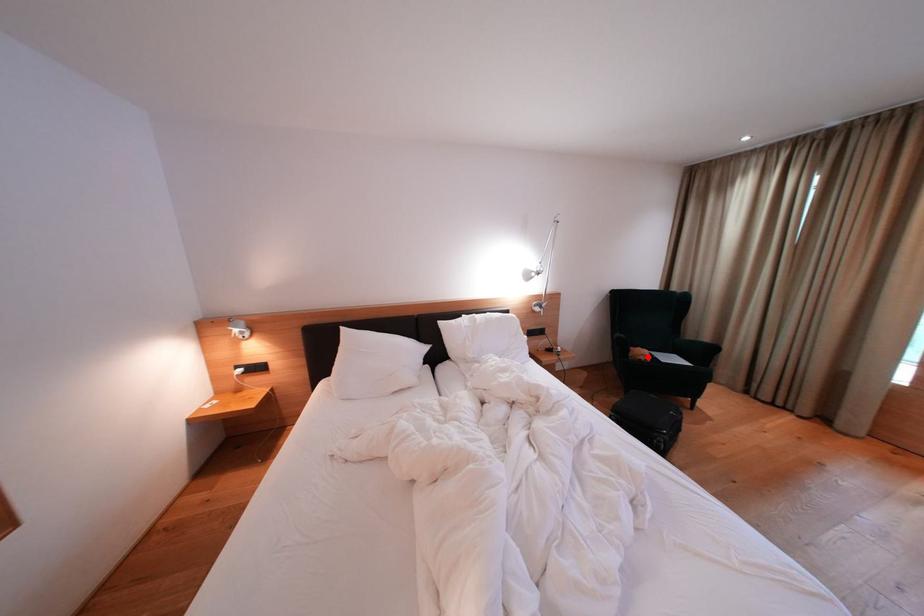
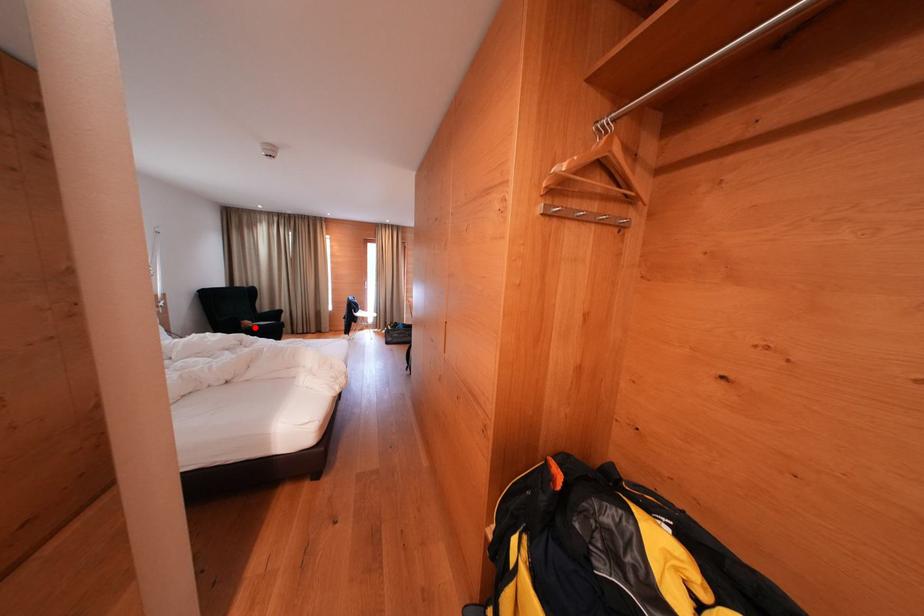
I am providing you with two images of the same scene from different viewpoints. A red point is marked on the first image and another point is marked on the second image. Does the point marked in image1 correspond to the same location as the one in image2?

Yes